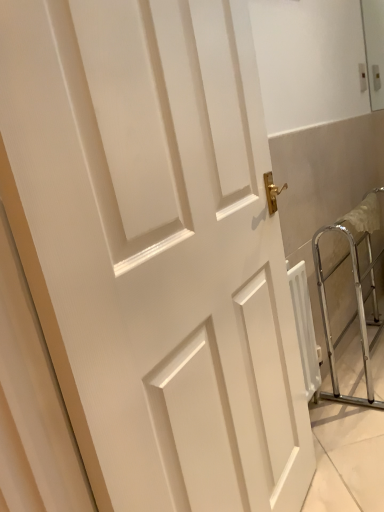
Where is `silver metallic walker at right`? silver metallic walker at right is located at coordinates (352, 315).

The height and width of the screenshot is (512, 384). What do you see at coordinates (352, 315) in the screenshot? I see `silver metallic walker at right` at bounding box center [352, 315].

Find the location of `silver metallic walker at right`. silver metallic walker at right is located at coordinates (352, 315).